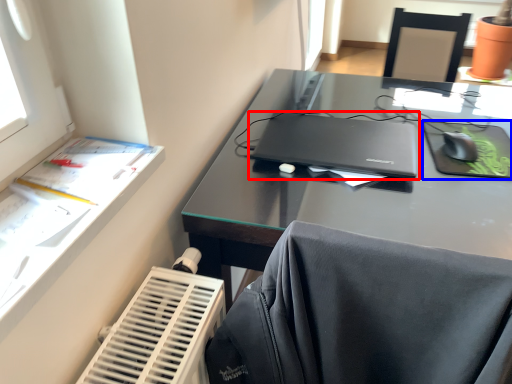
Question: Among these objects, which one is nearest to the camera, laptop (highlighted by a red box) or tablet computer (highlighted by a blue box)?

Choices:
 (A) laptop
 (B) tablet computer

Answer: (A)